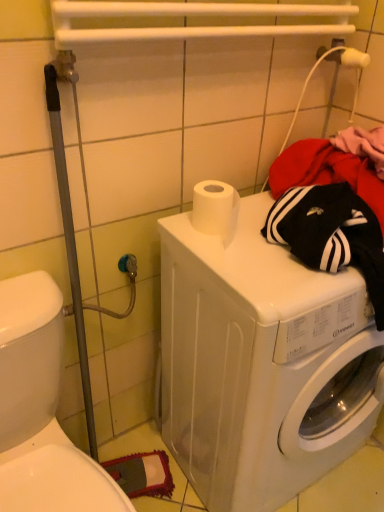
Question: Is point pyautogui.click(x=49, y=490) closer or farther from the camera than point pyautogui.click(x=301, y=288)?

Choices:
 (A) farther
 (B) closer

Answer: (A)

Question: In the image, is white plastic washer at lower right positioned in front of or behind white glossy washing machine at center?

Choices:
 (A) behind
 (B) front

Answer: (B)

Question: Which is correct: white plastic washer at lower right is inside white glossy washing machine at center, or outside of it?

Choices:
 (A) inside
 (B) outside

Answer: (B)

Question: Is white glossy washing machine at center to the left or to the right of white plastic washer at lower right in the image?

Choices:
 (A) left
 (B) right

Answer: (B)

Question: Is point (279, 348) closer or farther from the camera than point (59, 314)?

Choices:
 (A) farther
 (B) closer

Answer: (B)

Question: From the image's perspective, is white glossy washing machine at center above or below white plastic washer at lower right?

Choices:
 (A) below
 (B) above

Answer: (B)

Question: Is white glossy washing machine at center wider or thinner than white plastic washer at lower right?

Choices:
 (A) wide
 (B) thin

Answer: (B)